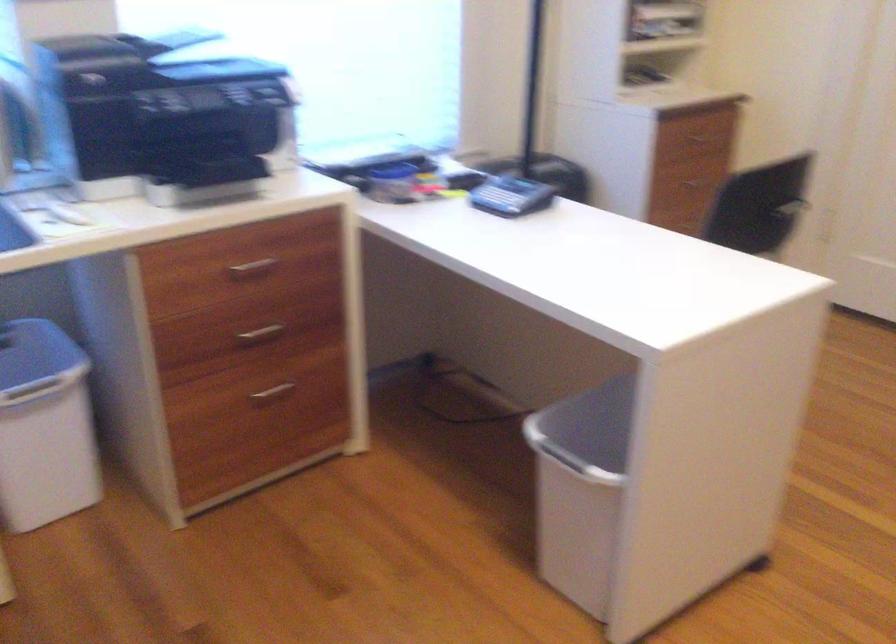
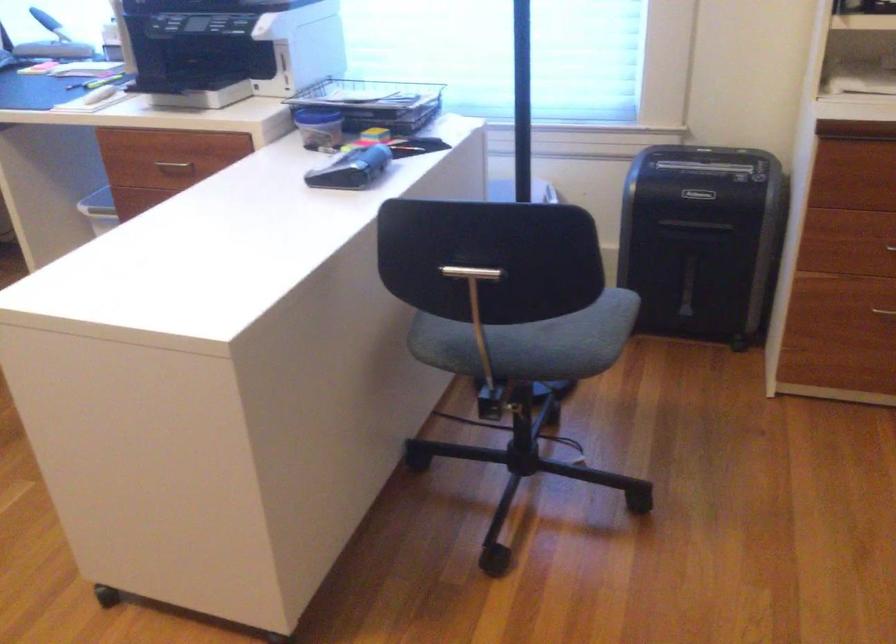
In the second image, find the point that corresponds to the point at 529,200 in the first image.

(351, 169)